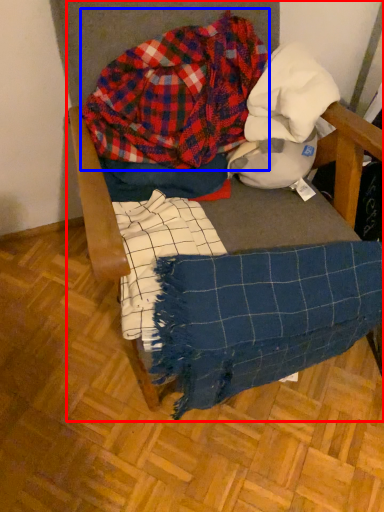
Question: Which object is further to the camera taking this photo, furniture (highlighted by a red box) or flannel (highlighted by a blue box)?

Choices:
 (A) furniture
 (B) flannel

Answer: (B)